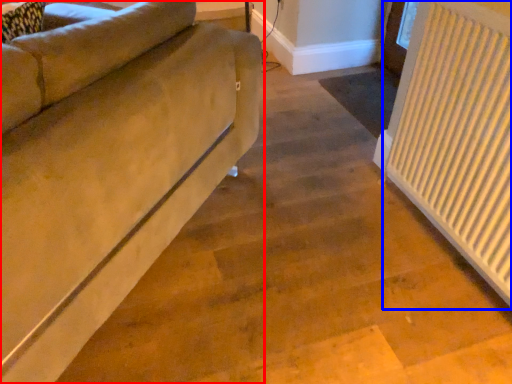
Question: Which object is closer to the camera taking this photo, studio couch (highlighted by a red box) or radiator (highlighted by a blue box)?

Choices:
 (A) studio couch
 (B) radiator

Answer: (A)